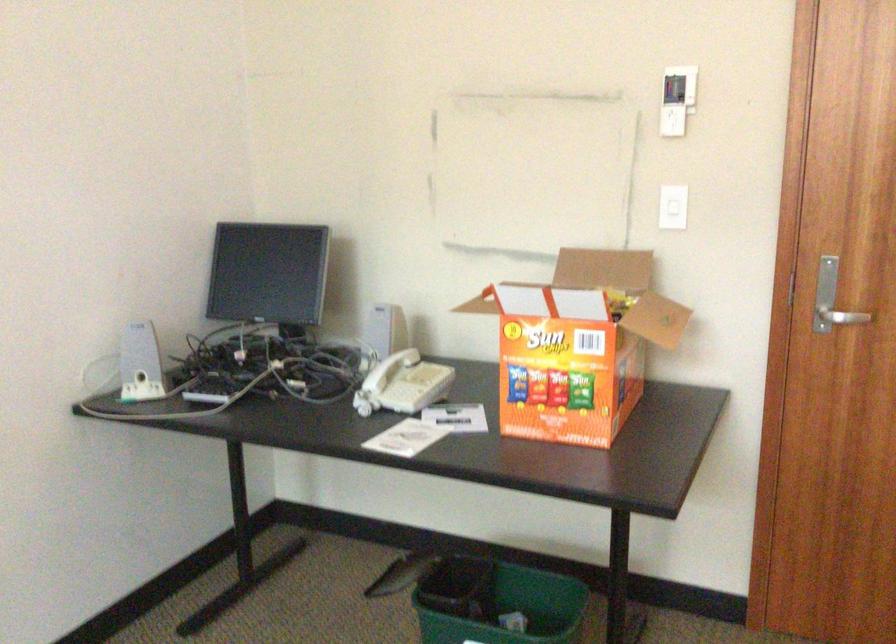
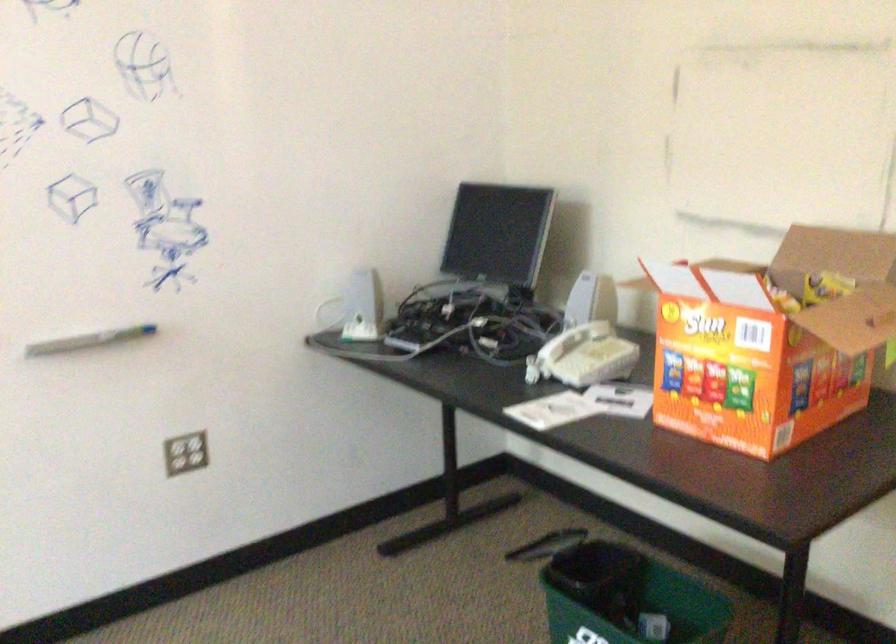
From the picture: The images are taken continuously from a first-person perspective. In which direction are you moving?

The cameraman moved toward right, forward.